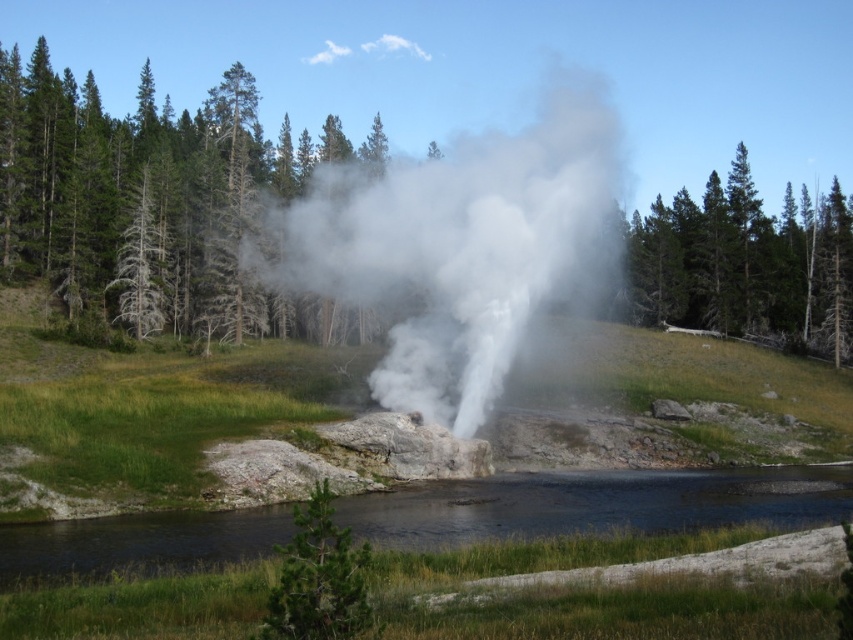
Question: Which point appears closest to the camera in this image?

Choices:
 (A) (404, 228)
 (B) (312, 324)

Answer: (A)

Question: Does green textured tree at center come in front of clear water at center?

Choices:
 (A) no
 (B) yes

Answer: (A)

Question: Which point is closer to the camera taking this photo?

Choices:
 (A) 727,502
 (B) 511,250
 (C) 785,296
 (D) 322,524

Answer: (D)

Question: Which of the following is the farthest from the observer?

Choices:
 (A) (521, 248)
 (B) (585, 524)
 (C) (115, 205)
 (D) (654, 237)

Answer: (D)

Question: Is clear water at center positioned in front of green matte tree at lower center?

Choices:
 (A) no
 (B) yes

Answer: (A)

Question: Is green coniferous tree at upper right above green matte tree at lower center?

Choices:
 (A) yes
 (B) no

Answer: (A)